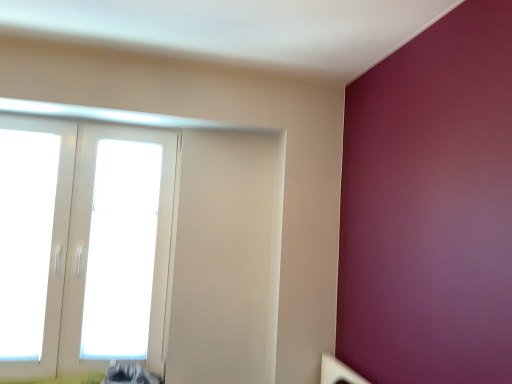
The image size is (512, 384). Describe the element at coordinates (84, 245) in the screenshot. I see `white plastic window at left` at that location.

The image size is (512, 384). Identify the location of white plastic window at left. pyautogui.click(x=84, y=245).

Measure the distance between white plastic window at left and camera.

The distance of white plastic window at left from camera is 2.11 meters.

Locate an element on the screen. The image size is (512, 384). white plastic window at left is located at coordinates (84, 245).